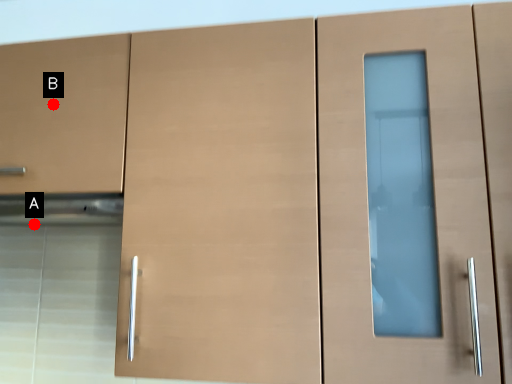
Question: Two points are circled on the image, labeled by A and B beside each circle. Which of the following is the closest to the observer?

Choices:
 (A) A is closer
 (B) B is closer

Answer: (B)